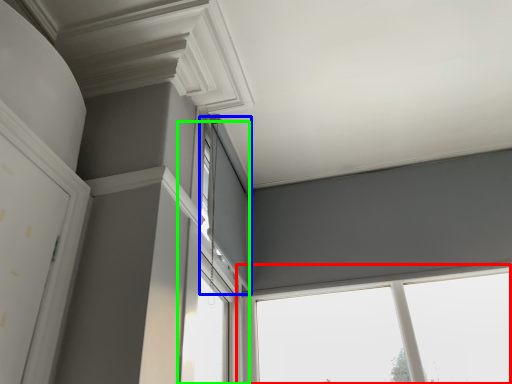
Question: Which object is positioned closest to window (highlighted by a red box)? Select from window (highlighted by a blue box) and window (highlighted by a green box).

Choices:
 (A) window
 (B) window

Answer: (B)